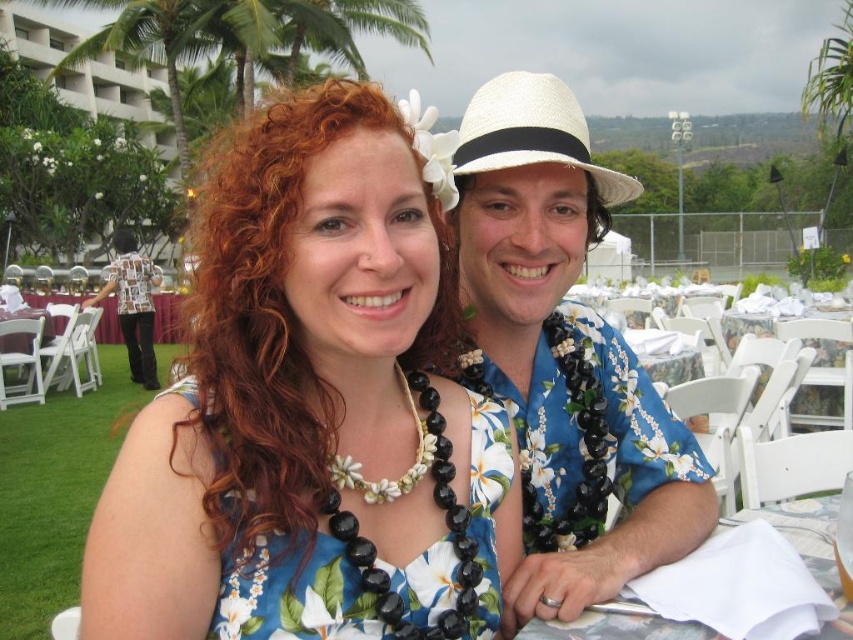
You are a photographer at the event and need to ensure both the floral dress at center and the white straw hat at upper center are clearly visible in your photo. Given their sizes, which object should you focus on first to ensure it doesn

The floral dress at center is smaller than the white straw hat at upper center, so you should focus on the floral dress at center first to ensure its details are captured clearly before adjusting for the larger hat.

You are a photographer at the event and want to ensure both the floral fabric dress at center and the white straw hat at upper center are in focus. Which object should you adjust your camera focus on first to account for their sizes?

The floral fabric dress at center is thinner than the white straw hat at upper center, so you should focus on the floral fabric dress at center first as it is smaller and requires precise focus.

You are a photographer at the event and need to position the floral dress at center and the floral shirt at center so that both are visible in the frame. Which clothing item should you place closer to the camera to ensure it doesn

The floral dress at center is not as tall as the floral shirt at center. To ensure both are visible in the frame, place the floral dress at center closer to the camera since it is shorter and might be partially obscured by the taller floral shirt at center.